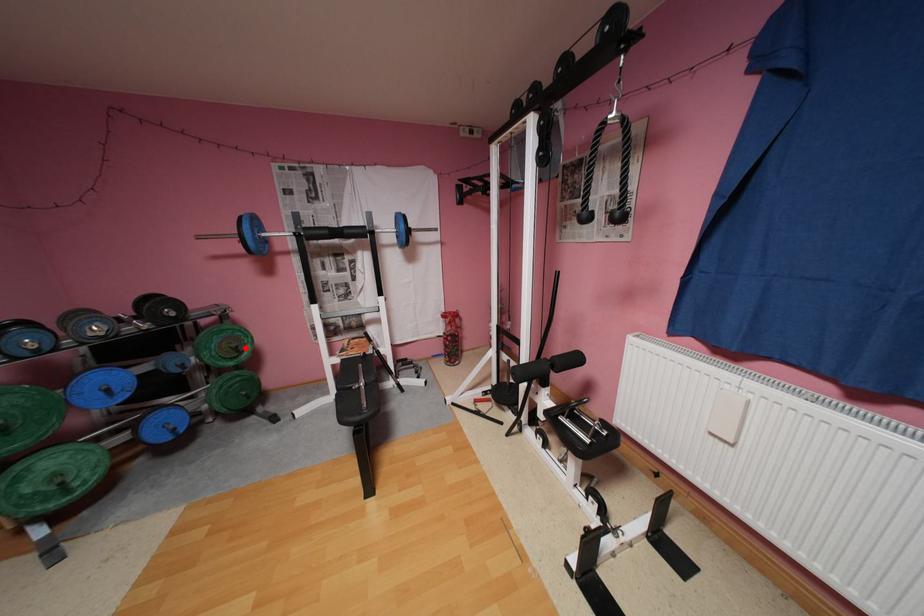
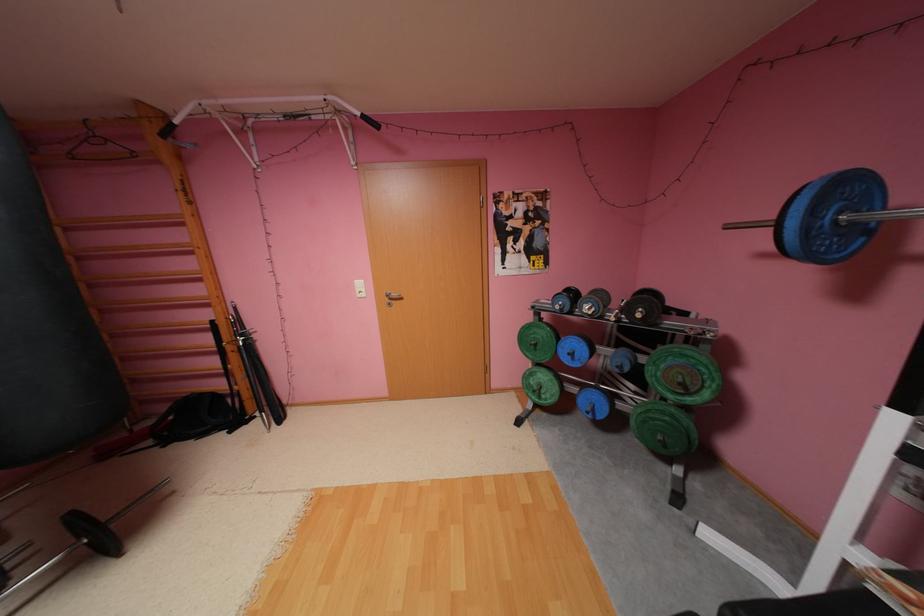
Where in the second image is the point corresponding to the highlighted location from the first image?

(690, 384)